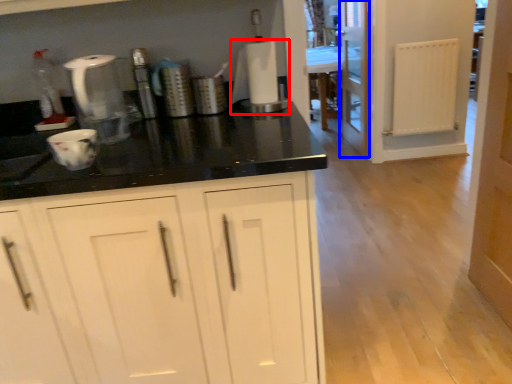
Question: Which object appears closest to the camera in this image, appliance (highlighted by a red box) or screen door (highlighted by a blue box)?

Choices:
 (A) appliance
 (B) screen door

Answer: (A)